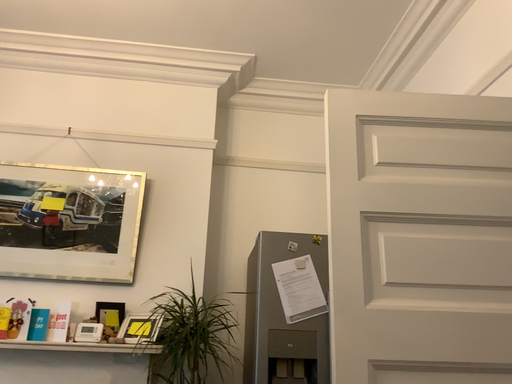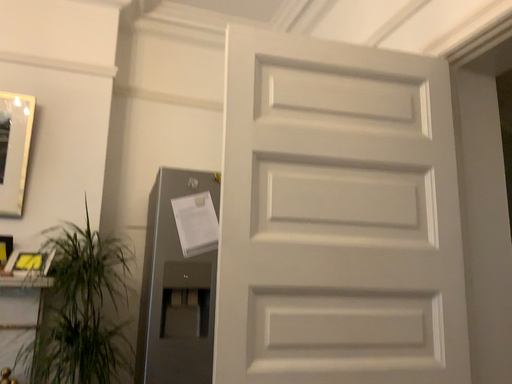
Question: Which way did the camera rotate in the video?

Choices:
 (A) rotated right
 (B) rotated left

Answer: (A)